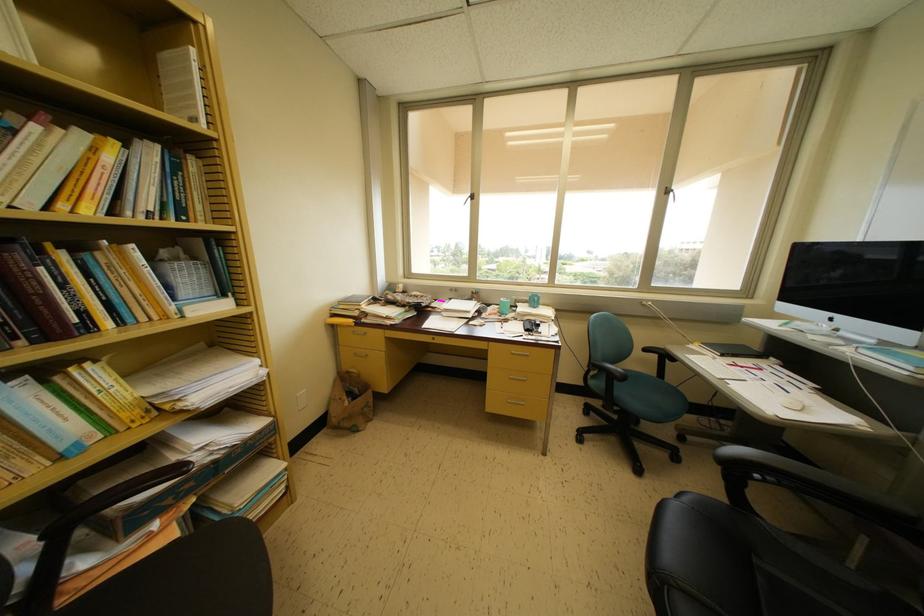
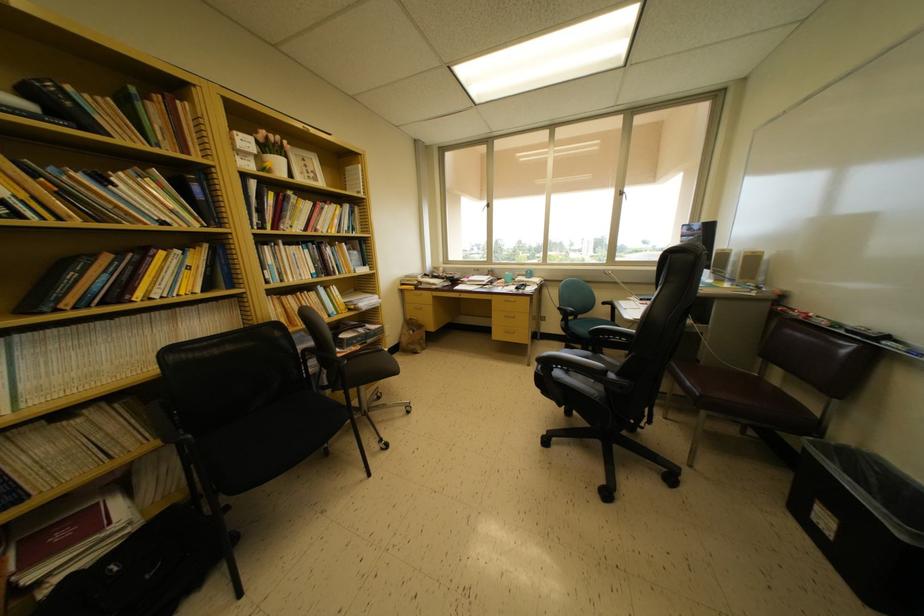
Question: The images are taken continuously from a first-person perspective. In which direction are you moving?

Choices:
 (A) Left
 (B) Right
 (C) Forward
 (D) Backward

Answer: (D)